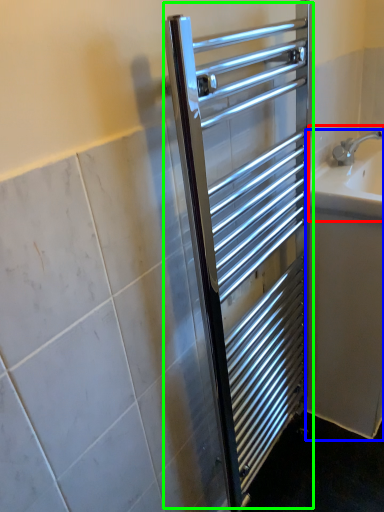
Question: Estimate the real-world distances between objects in this image. Which object is farther from sink (highlighted by a red box), bath (highlighted by a blue box) or screen door (highlighted by a green box)?

Choices:
 (A) bath
 (B) screen door

Answer: (B)